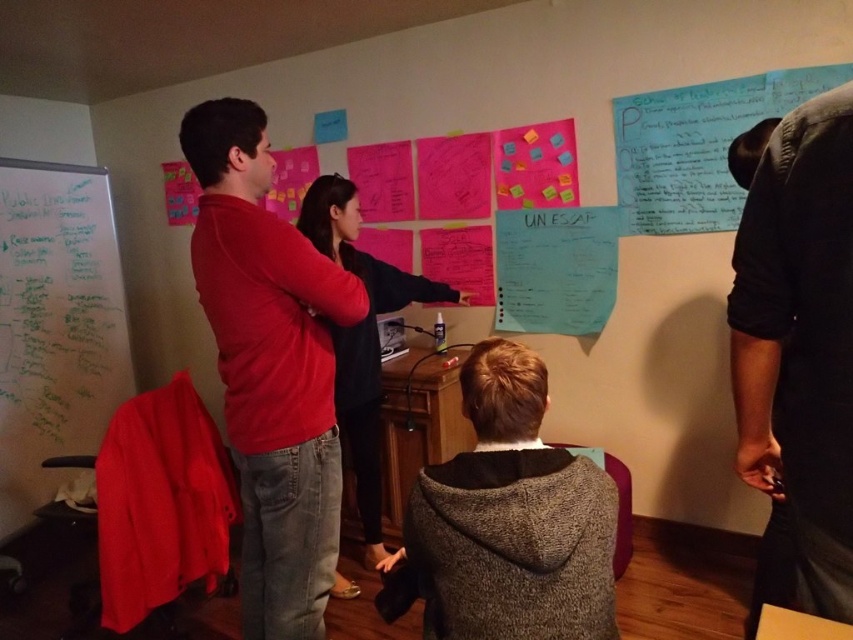
You are a photographer trying to capture a photo of both the matte red shirt at center and the dark gray hoodie at center in the same frame. Based on their positions, which person should you move closer to the camera to ensure both are fully visible?

Since the matte red shirt at center is much taller than the dark gray hoodie at center, you should move the dark gray hoodie at center closer to the camera to ensure both are fully visible in the photo.

You are a new member joining the brainstorming session and need to find the dark gray shirt at upper right and the black sweater at center. Which one is located to the right of the other?

The dark gray shirt at upper right is positioned on the right side of black sweater at center.